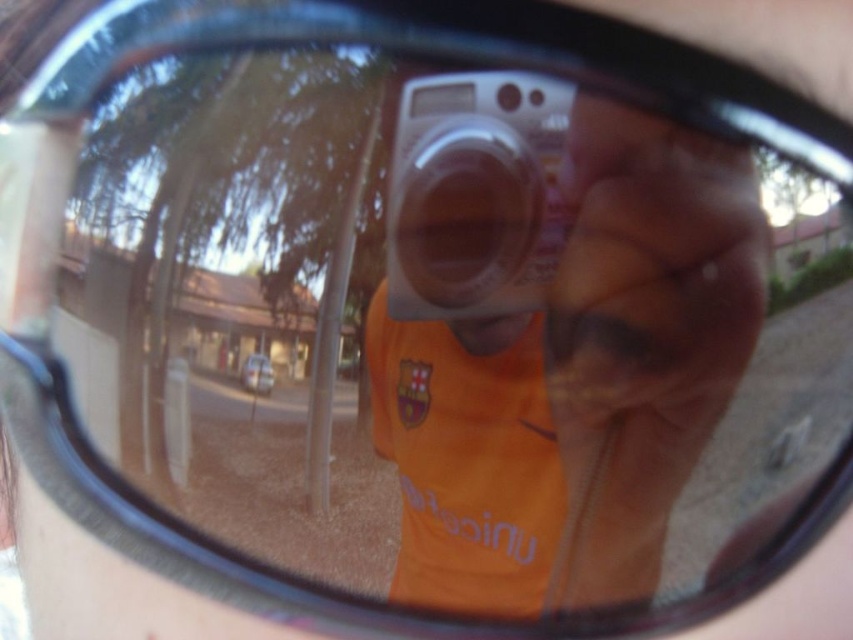
Who is positioned more to the left, orange fabric at center or silver metallic camera at center?

silver metallic camera at center is more to the left.

Who is shorter, orange fabric at center or silver metallic camera at center?

With less height is silver metallic camera at center.

The height and width of the screenshot is (640, 853). What do you see at coordinates (560, 356) in the screenshot?
I see `orange fabric at center` at bounding box center [560, 356].

Locate an element on the screen. The width and height of the screenshot is (853, 640). orange fabric at center is located at coordinates 560,356.